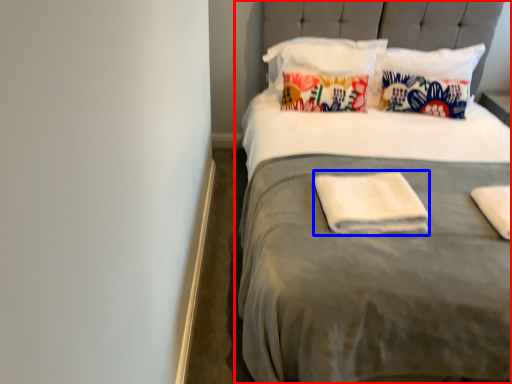
Question: Which of the following is the closest to the observer, bed (highlighted by a red box) or material (highlighted by a blue box)?

Choices:
 (A) bed
 (B) material

Answer: (A)